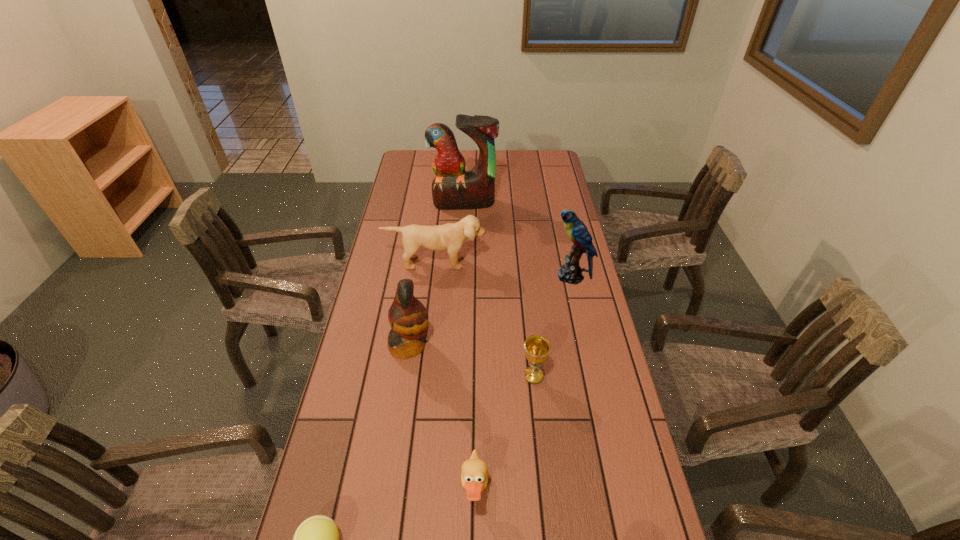
This screenshot has width=960, height=540. Identify the location of the farthest object. (453, 188).

Find the location of `the tallest object`. the tallest object is located at coordinates (453, 188).

Identify the location of the fourth nearest object. tap(408, 317).

Locate an element on the screen. the second nearest parrot is located at coordinates (571, 272).

Locate an element on the screen. the rightmost parrot is located at coordinates (571, 272).

Locate an element on the screen. puppy is located at coordinates (450, 237).

This screenshot has width=960, height=540. I want to click on the third nearest object, so click(536, 348).

In order to click on the sixth object from left to right in this screenshot , I will do click(536, 348).

Locate an element on the screen. This screenshot has width=960, height=540. duck is located at coordinates (474, 477).

The image size is (960, 540). I want to click on vacant region located at the face of the tallest parrot, so click(x=460, y=275).